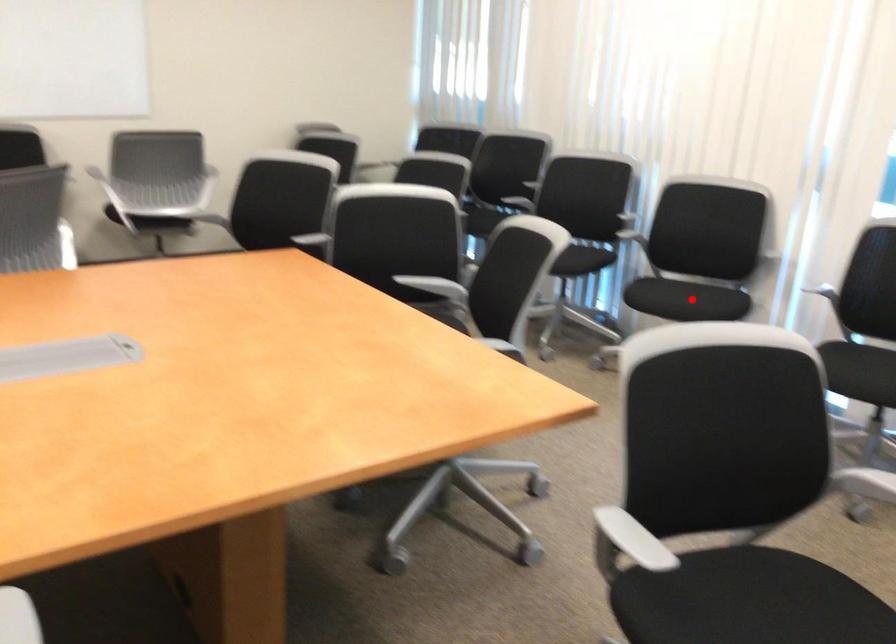
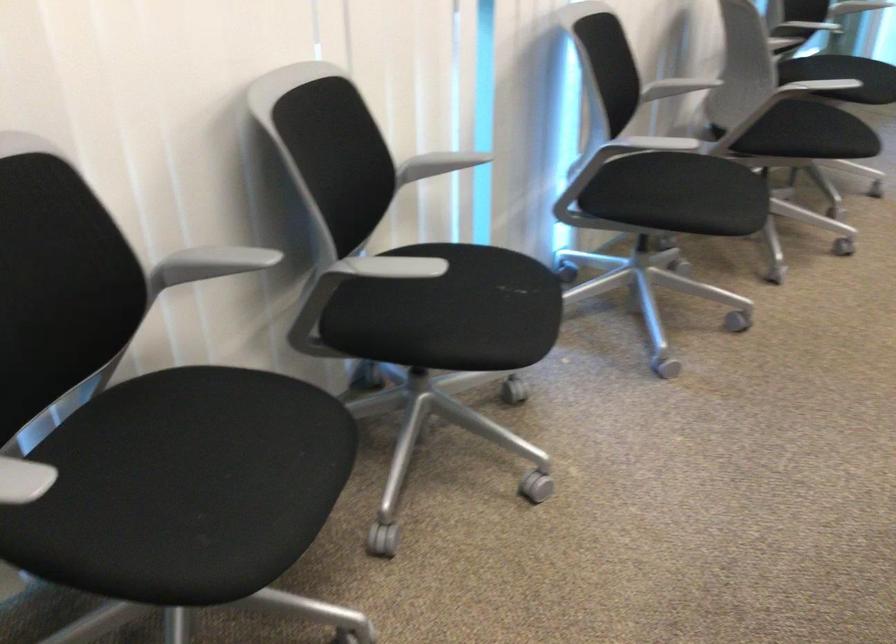
Question: I am providing you with two images of the same scene from different viewpoints. Image1 has a red point marked. In image2, the corresponding 3D location appears at what relative position? Reply with the corresponding letter.

Choices:
 (A) Closer
 (B) Farther

Answer: (A)